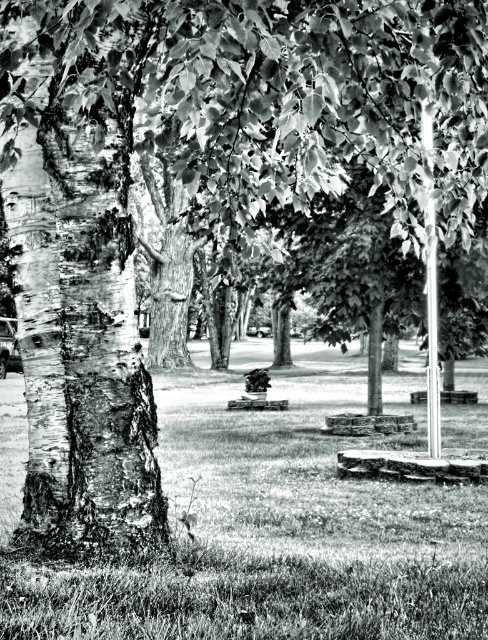
Question: Observing the image, what is the correct spatial positioning of barky white tree trunk at left in reference to metallic pole at upper right?

Choices:
 (A) left
 (B) right

Answer: (A)

Question: Considering the real-world distances, which object is farthest from the barky white tree trunk at left?

Choices:
 (A) grassy lawn at center
 (B) metallic pole at upper right

Answer: (A)

Question: Considering the relative positions of barky white tree trunk at left and metallic pole at upper right in the image provided, where is barky white tree trunk at left located with respect to metallic pole at upper right?

Choices:
 (A) below
 (B) above

Answer: (B)

Question: Which is nearer to the metallic pole at upper right?

Choices:
 (A) barky white tree trunk at left
 (B) grassy lawn at center

Answer: (B)

Question: Which of the following is the farthest from the observer?

Choices:
 (A) grassy lawn at center
 (B) barky white tree trunk at left
 (C) metallic pole at upper right

Answer: (C)

Question: Is grassy lawn at center to the right of barky white tree trunk at left from the viewer's perspective?

Choices:
 (A) yes
 (B) no

Answer: (B)